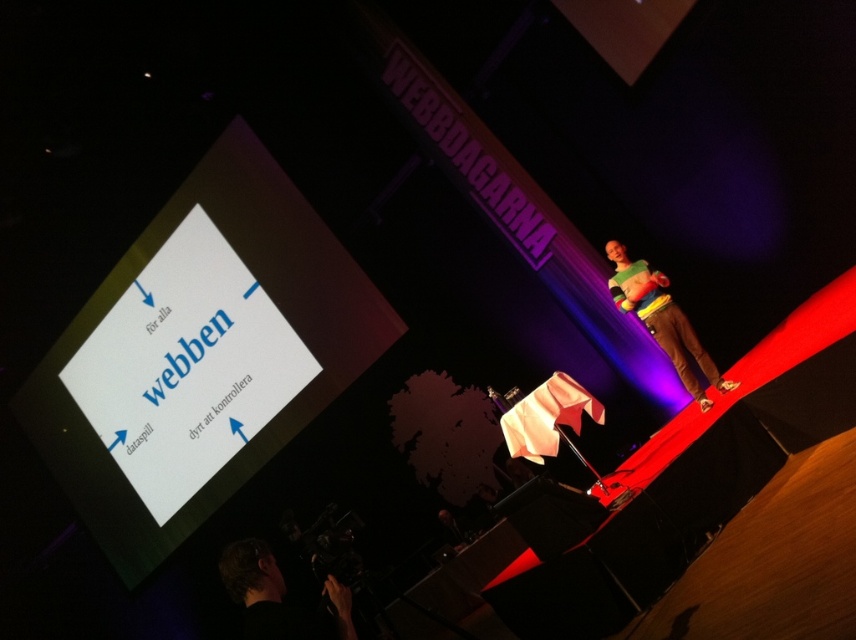
Consider the image. Between black fabric camera at lower left and multicolored sweater at right, which one is positioned higher?

multicolored sweater at right is higher up.

Is black fabric camera at lower left taller than multicolored sweater at right?

No, black fabric camera at lower left is not taller than multicolored sweater at right.

Is point (277, 589) positioned behind point (676, 337)?

No.

Where is `black fabric camera at lower left`? black fabric camera at lower left is located at coordinates (278, 596).